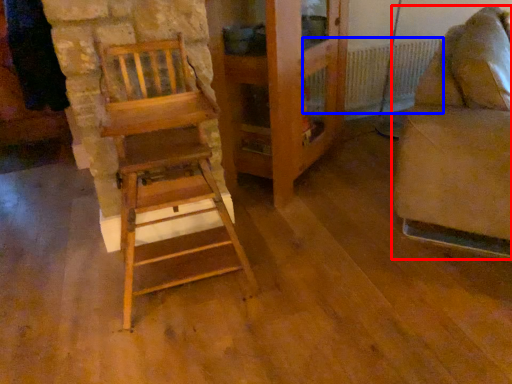
Question: Which point is further to the camera, furniture (highlighted by a red box) or radiator (highlighted by a blue box)?

Choices:
 (A) furniture
 (B) radiator

Answer: (B)